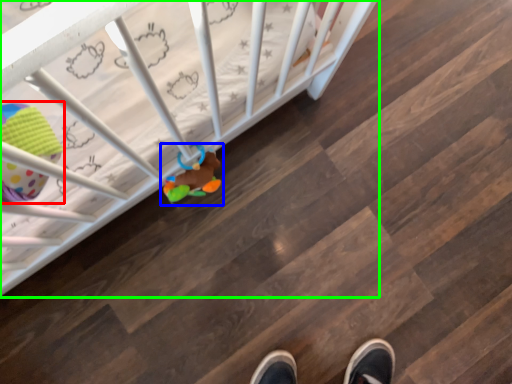
Question: Based on their relative distances, which object is farther from toy (highlighted by a red box)? Choose from toy (highlighted by a blue box) and infant bed (highlighted by a green box).

Choices:
 (A) toy
 (B) infant bed

Answer: (A)